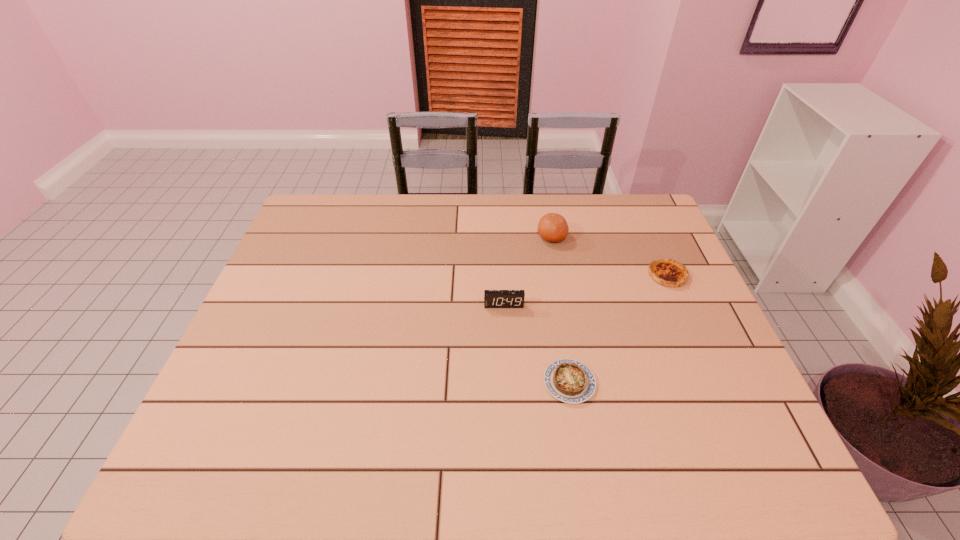
I want to click on vacant space located 0.050m on the left of the second farthest object, so click(632, 275).

Locate an element on the screen. The height and width of the screenshot is (540, 960). vacant space situated on the left of the nearest object is located at coordinates (429, 383).

The height and width of the screenshot is (540, 960). Find the location of `object at the far edge`. object at the far edge is located at coordinates (552, 227).

What are the coordinates of `object located at the right edge` in the screenshot? It's located at (669, 273).

Where is `free region at the far edge of the desktop`? This screenshot has width=960, height=540. free region at the far edge of the desktop is located at coordinates (576, 210).

Where is `free space at the near edge of the desktop`? This screenshot has height=540, width=960. free space at the near edge of the desktop is located at coordinates (437, 468).

Where is `vacant point at the left edge`? The width and height of the screenshot is (960, 540). vacant point at the left edge is located at coordinates (300, 262).

What are the coordinates of `vacant area at the far right corner of the desktop` in the screenshot? It's located at click(x=625, y=232).

Where is `vacant area between the left quiche and the farther quiche`? The image size is (960, 540). vacant area between the left quiche and the farther quiche is located at coordinates (618, 329).

Find the location of `vacant space in between the farthest object and the nearer quiche`. vacant space in between the farthest object and the nearer quiche is located at coordinates (561, 310).